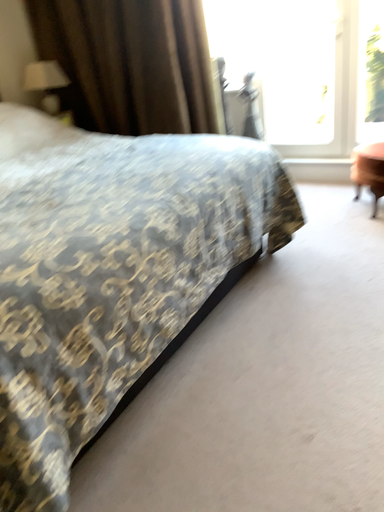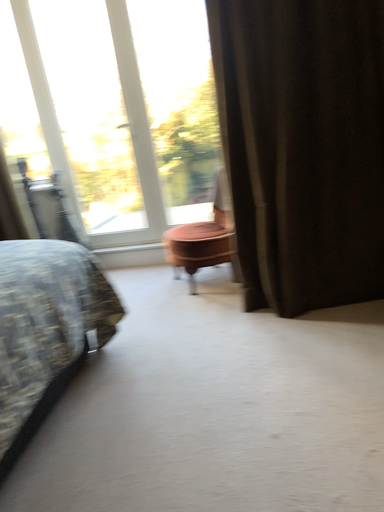
Question: Which way did the camera rotate in the video?

Choices:
 (A) rotated left
 (B) rotated right

Answer: (B)